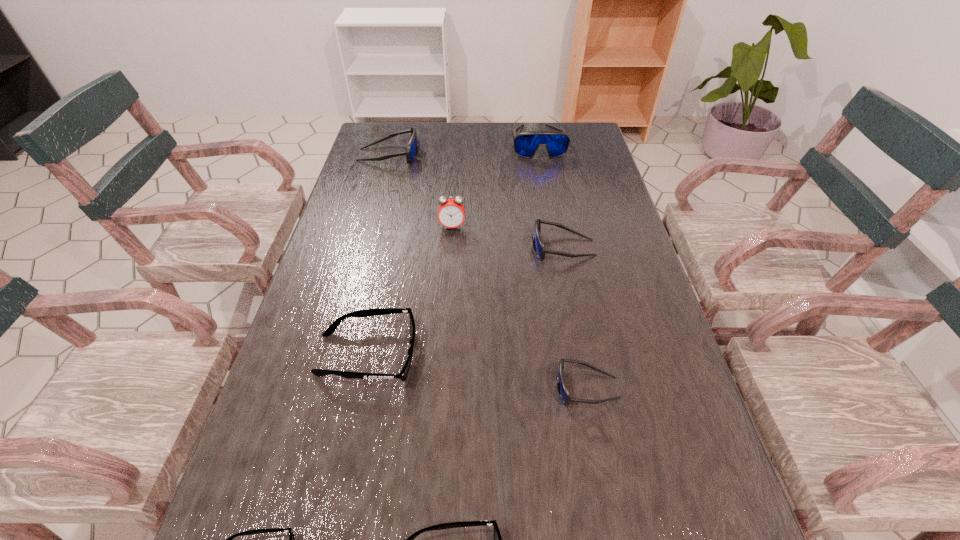
Image resolution: width=960 pixels, height=540 pixels. I want to click on free region located on the front-facing side of the second tallest sunglasses, so click(x=488, y=155).

Locate an element on the screen. The width and height of the screenshot is (960, 540). vacant space located 0.140m on the front-facing side of the third tallest sunglasses is located at coordinates (479, 247).

Where is `free location located 0.100m on the front-facing side of the third tallest sunglasses`? This screenshot has height=540, width=960. free location located 0.100m on the front-facing side of the third tallest sunglasses is located at coordinates (493, 247).

At what (x,y) coordinates should I click in order to perform the action: click on vacant position located on the front-facing side of the third tallest sunglasses. Please return your answer as a coordinate pair (x, y). Looking at the image, I should click on (415, 247).

At what (x,y) coordinates should I click in order to perform the action: click on free point located on the front-facing side of the farthest black sunglasses. Please return your answer as a coordinate pair (x, y). The image size is (960, 540). Looking at the image, I should click on (506, 355).

Locate an element on the screen. vacant space located 0.110m on the front-facing side of the smallest blue sunglasses is located at coordinates (500, 387).

This screenshot has width=960, height=540. I want to click on vacant position located on the front-facing side of the smallest blue sunglasses, so click(366, 387).

Locate an element on the screen. The width and height of the screenshot is (960, 540). free space located on the front-facing side of the smallest blue sunglasses is located at coordinates (491, 387).

Image resolution: width=960 pixels, height=540 pixels. I want to click on object that is at the far left corner, so click(x=411, y=152).

Locate an element on the screen. The width and height of the screenshot is (960, 540). object that is positioned at the far right corner is located at coordinates (526, 144).